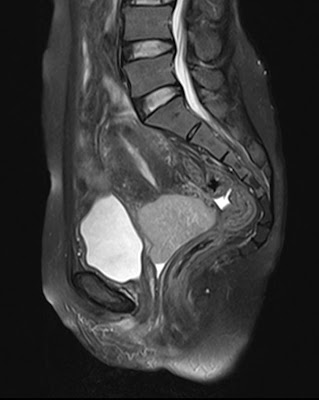
At what (x,y) coordinates should I click in order to perform the action: click on black organ. Please return your answer as a coordinate pair (x, y). This screenshot has width=319, height=400. Looking at the image, I should click on (97, 287).